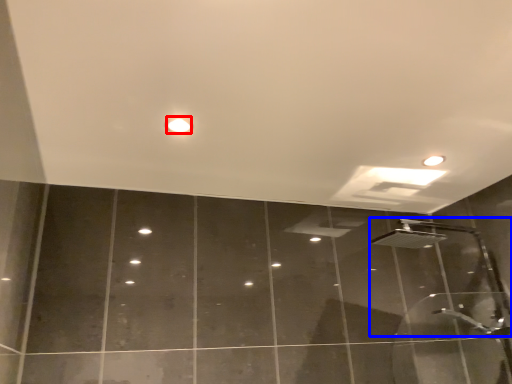
Question: Which object appears closest to the camera in this image, droplight (highlighted by a red box) or shower (highlighted by a blue box)?

Choices:
 (A) droplight
 (B) shower

Answer: (A)